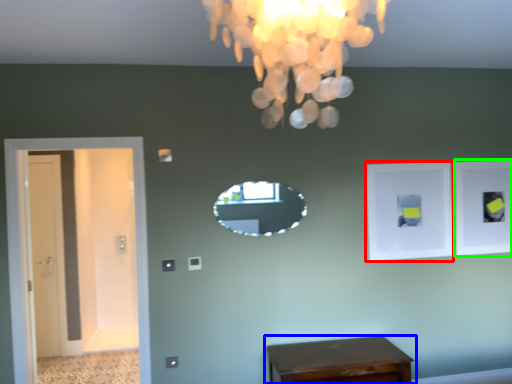
Question: Which object is positioned farthest from picture frame (highlighted by a red box)? Select from table (highlighted by a blue box) and picture frame (highlighted by a green box).

Choices:
 (A) table
 (B) picture frame

Answer: (A)